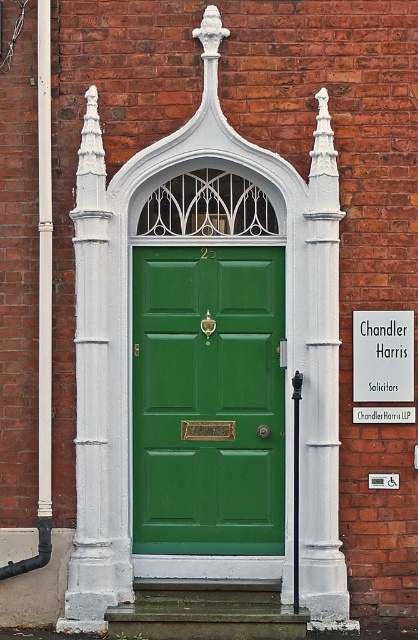
You are a painter who needs to decide which object to paint first. The green matte door at center and the white painted stone pillar at center are both in your current view. Based on their sizes, which one should you tackle first if you want to start with the larger object?

The green matte door at center is bigger than the white painted stone pillar at center, so you should paint the green matte door at center first since it is larger.

You are a delivery person with a package that needs to be placed between the green matte door at center and the white painted stone column at left. The package is 20 inches wide. Will it fit in the space between them?

The green matte door at center and white painted stone column at left are 20.15 inches apart. Since the package is 20 inches wide, it will fit with a small amount of space remaining.

You are a visitor approaching the entrance of the building. You notice the white painted stone column at left and the white painted stone pillar at center. Which one is positioned higher relative to the other?

The white painted stone column at left is located above the white painted stone pillar at center, so it is positioned higher.